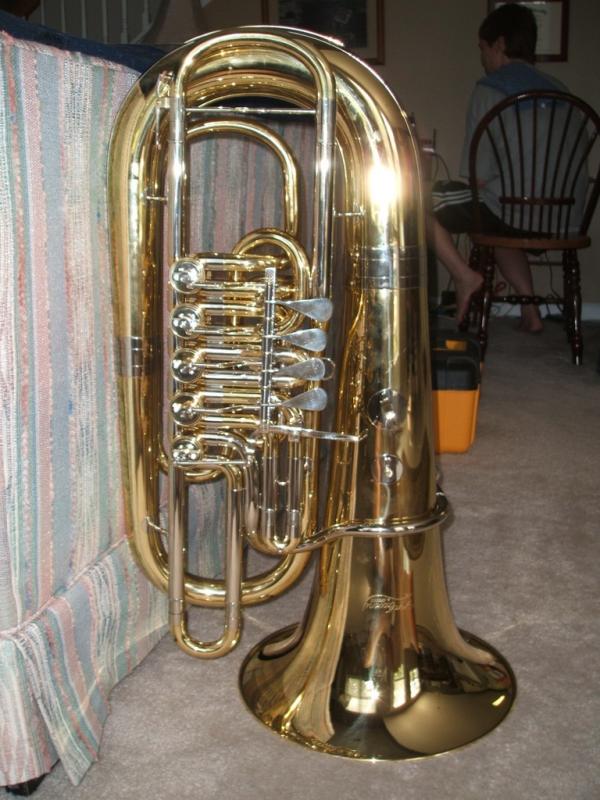
Where is `chair back`? This screenshot has width=600, height=800. chair back is located at coordinates tap(533, 90).